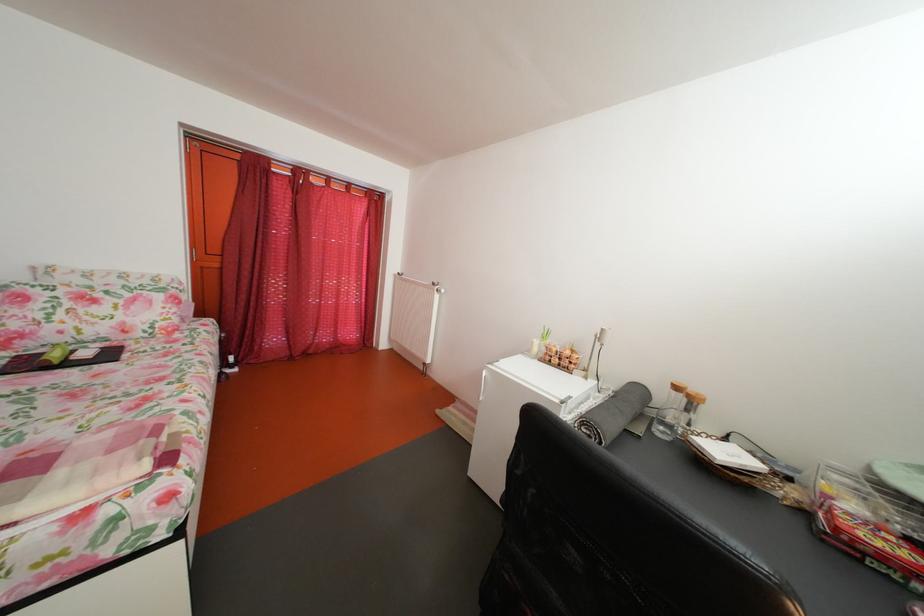
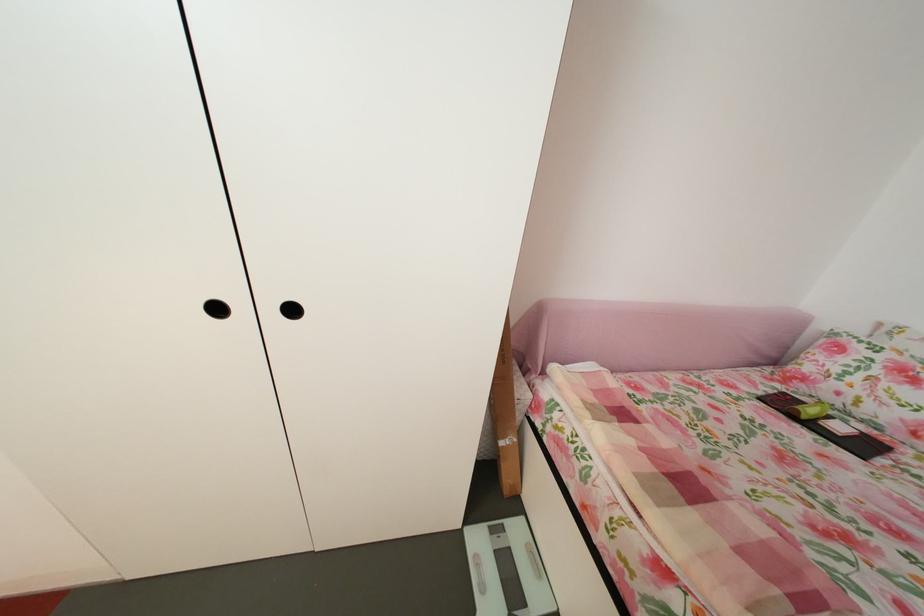
Locate, in the second image, the point that corresponds to [71,339] in the first image.

(849, 400)